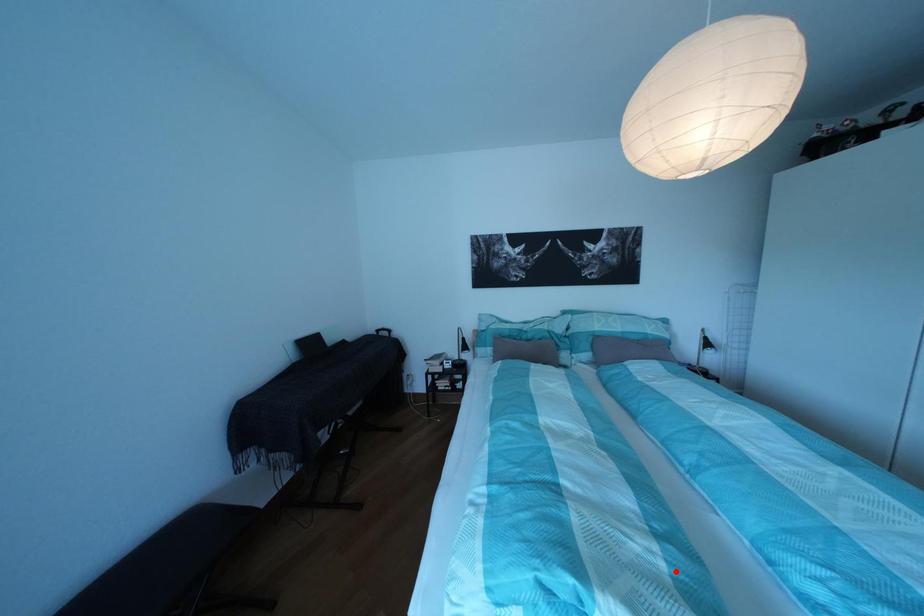
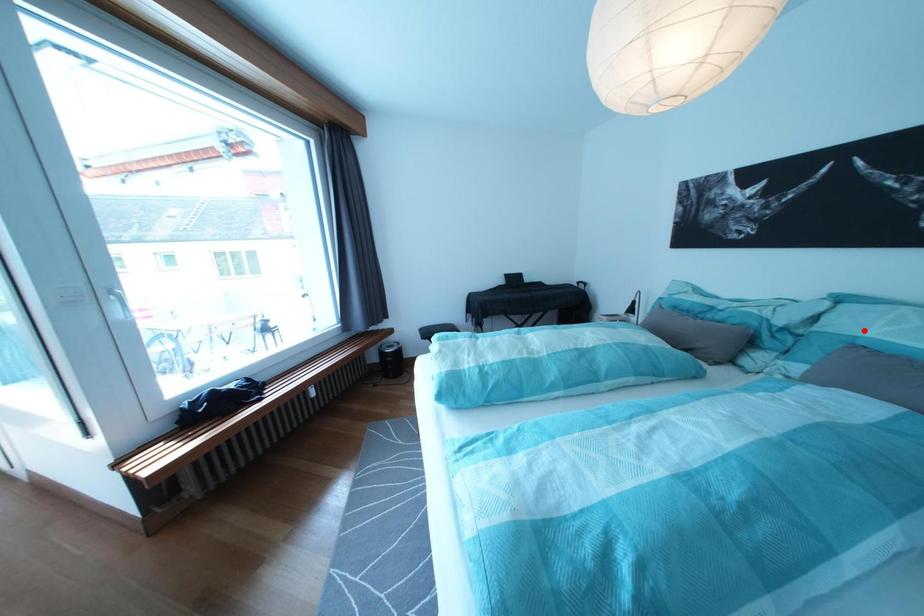
I am providing you with two images of the same scene from different viewpoints. A red point is marked on the first image and another point is marked on the second image. Is the marked point in image1 the same physical position as the marked point in image2?

No